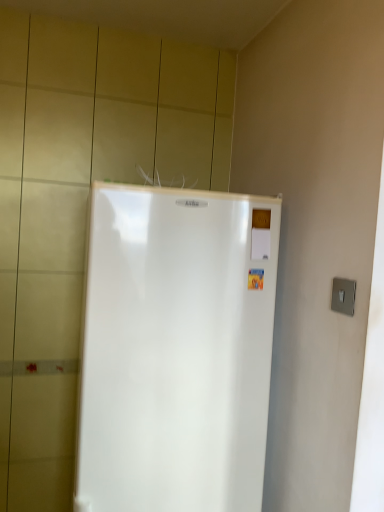
Question: Does satin silver switch at right have a lesser height compared to white glossy refrigerator at center?

Choices:
 (A) yes
 (B) no

Answer: (A)

Question: Is satin silver switch at right to the right of white glossy refrigerator at center from the viewer's perspective?

Choices:
 (A) no
 (B) yes

Answer: (B)

Question: From the image's perspective, is satin silver switch at right located beneath white glossy refrigerator at center?

Choices:
 (A) no
 (B) yes

Answer: (A)

Question: Is satin silver switch at right beside white glossy refrigerator at center?

Choices:
 (A) yes
 (B) no

Answer: (B)

Question: Does satin silver switch at right have a smaller size compared to white glossy refrigerator at center?

Choices:
 (A) yes
 (B) no

Answer: (A)

Question: Is white glossy refrigerator at center surrounded by satin silver switch at right?

Choices:
 (A) no
 (B) yes

Answer: (A)

Question: Can you confirm if white glossy refrigerator at center is thinner than satin silver switch at right?

Choices:
 (A) no
 (B) yes

Answer: (A)

Question: Is white glossy refrigerator at center turned away from satin silver switch at right?

Choices:
 (A) yes
 (B) no

Answer: (B)

Question: Is white glossy refrigerator at center shorter than satin silver switch at right?

Choices:
 (A) no
 (B) yes

Answer: (A)

Question: From the image's perspective, is white glossy refrigerator at center above satin silver switch at right?

Choices:
 (A) no
 (B) yes

Answer: (A)

Question: Is white glossy refrigerator at center wider than satin silver switch at right?

Choices:
 (A) no
 (B) yes

Answer: (B)

Question: Considering the relative sizes of white glossy refrigerator at center and satin silver switch at right in the image provided, is white glossy refrigerator at center bigger than satin silver switch at right?

Choices:
 (A) yes
 (B) no

Answer: (A)

Question: Relative to satin silver switch at right, is white glossy refrigerator at center in front or behind?

Choices:
 (A) front
 (B) behind

Answer: (B)